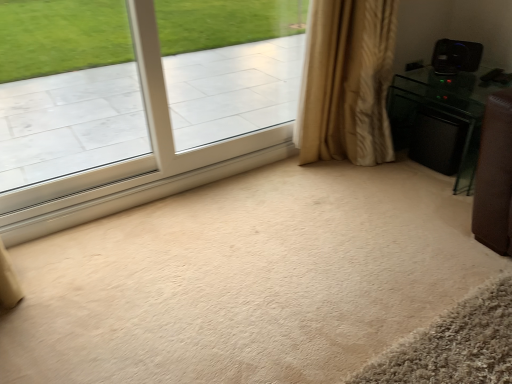
Question: Does black plastic speaker at upper right appear on the right side of black glossy speaker at right?

Choices:
 (A) no
 (B) yes

Answer: (B)

Question: Is black plastic speaker at upper right not near black glossy speaker at right?

Choices:
 (A) yes
 (B) no

Answer: (B)

Question: Can you confirm if black plastic speaker at upper right is taller than black glossy speaker at right?

Choices:
 (A) yes
 (B) no

Answer: (B)

Question: Is black glossy speaker at right completely or partially inside black plastic speaker at upper right?

Choices:
 (A) no
 (B) yes

Answer: (A)

Question: From a real-world perspective, is black plastic speaker at upper right beneath black glossy speaker at right?

Choices:
 (A) no
 (B) yes

Answer: (A)

Question: Does black plastic speaker at upper right have a lesser height compared to black glossy speaker at right?

Choices:
 (A) yes
 (B) no

Answer: (A)

Question: Is beige textured curtain at right completely or partially outside of clear glass window at upper left?

Choices:
 (A) no
 (B) yes

Answer: (B)

Question: Is beige textured curtain at right beside clear glass window at upper left?

Choices:
 (A) no
 (B) yes

Answer: (A)

Question: Can you confirm if beige textured curtain at right is wider than clear glass window at upper left?

Choices:
 (A) yes
 (B) no

Answer: (A)

Question: Can you confirm if beige textured curtain at right is smaller than clear glass window at upper left?

Choices:
 (A) no
 (B) yes

Answer: (A)

Question: Is beige textured curtain at right looking in the opposite direction of clear glass window at upper left?

Choices:
 (A) no
 (B) yes

Answer: (A)

Question: Does beige textured curtain at right have a larger size compared to clear glass window at upper left?

Choices:
 (A) yes
 (B) no

Answer: (A)

Question: Is black glossy speaker at right not within clear glass window at upper left?

Choices:
 (A) yes
 (B) no

Answer: (A)